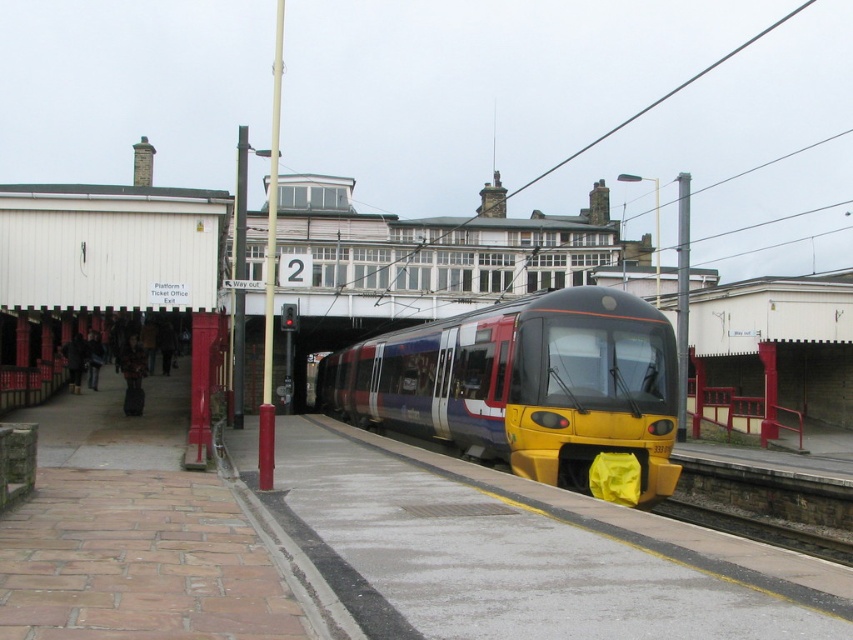
You are standing on the train station platform and want to walk from the covered waiting area to the ticket office. You notice two points marked on the ground at coordinates point [358,406] and point [785,544]. Which point is closer to you as you stand at the starting position?

Point [358,406] is closer to you because it is further to the viewer than point [785,544], meaning it is nearer in your line of sight.